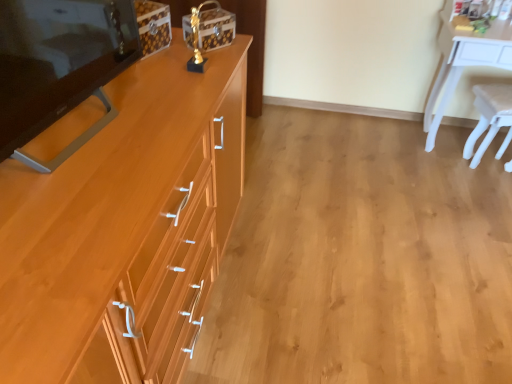
This screenshot has height=384, width=512. In order to click on vacant region in front of matte wood changing table at left in this screenshot , I will do `click(76, 212)`.